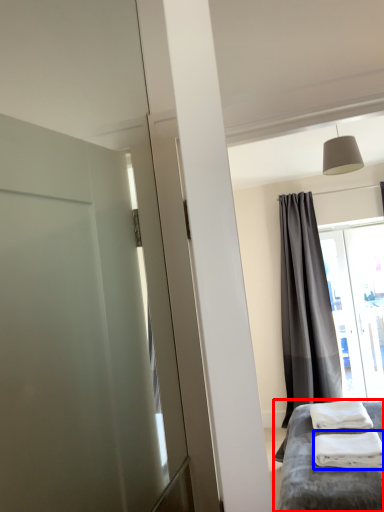
Question: Which of the following is the closest to the observer, furniture (highlighted by a red box) or material (highlighted by a blue box)?

Choices:
 (A) furniture
 (B) material

Answer: (A)